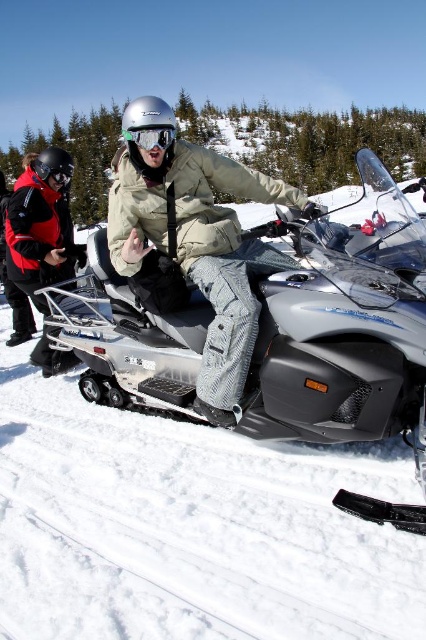
You are a delivery robot with a 3.5 feet wide package. You need to move from the red jacket at left to the metallic silver snowmobile at center. Can you fit through the space between them?

The distance between the metallic silver snowmobile at center and the red jacket at left is 9.30 feet. Since the package is 3.5 feet wide, there is sufficient space for the robot to navigate through the 9.30 feet gap.

You are a photographer trying to capture both the red jacket at left and the clear plastic goggles at center in a single frame. Since the camera has a limited focus range, which object should you prioritize focusing on to ensure it appears sharp?

The red jacket at left should be prioritized for focus because it is larger in size than the clear plastic goggles at center, making it more likely to be in focus within the camera range.